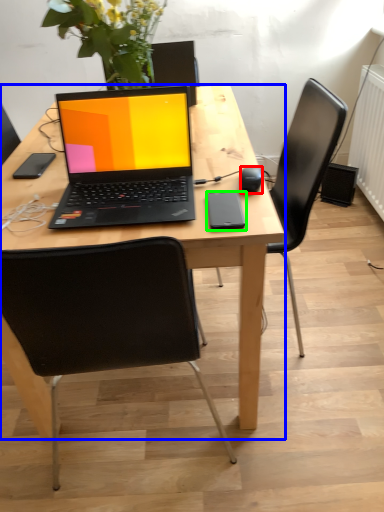
Question: Considering the real-world distances, which object is farthest from computer mouse (highlighted by a red box)? desk (highlighted by a blue box) or mobile phone (highlighted by a green box)?

Choices:
 (A) desk
 (B) mobile phone

Answer: (A)